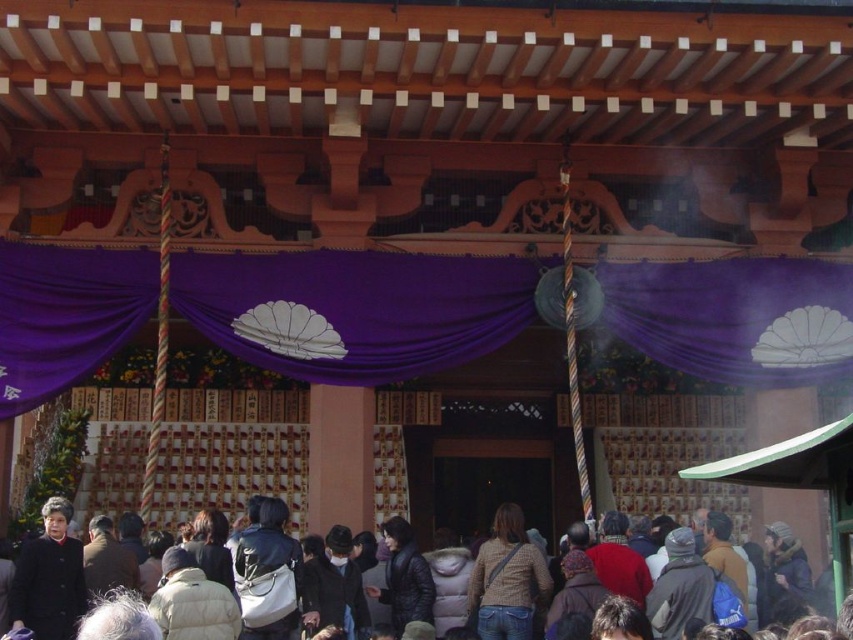
Question: Which point is closer to the camera?

Choices:
 (A) (39, 561)
 (B) (410, 349)
 (C) (201, 611)
 (D) (509, 508)

Answer: (C)

Question: Does dark brown leather jacket at lower center lie behind knitted beige sweater at center?

Choices:
 (A) yes
 (B) no

Answer: (B)

Question: Does purple fabric curtain at center have a greater width compared to dark brown leather jacket at lower center?

Choices:
 (A) yes
 (B) no

Answer: (A)

Question: Is purple fabric curtain at center in front of knitted beige sweater at center?

Choices:
 (A) no
 (B) yes

Answer: (A)

Question: Among these objects, which one is farthest from the camera?

Choices:
 (A) dark brown leather jacket at lower center
 (B) dark brown leather coat at lower left

Answer: (B)

Question: Which object appears closest to the camera in this image?

Choices:
 (A) knitted beige sweater at center
 (B) dark brown leather coat at lower left
 (C) dark brown leather jacket at lower center

Answer: (C)